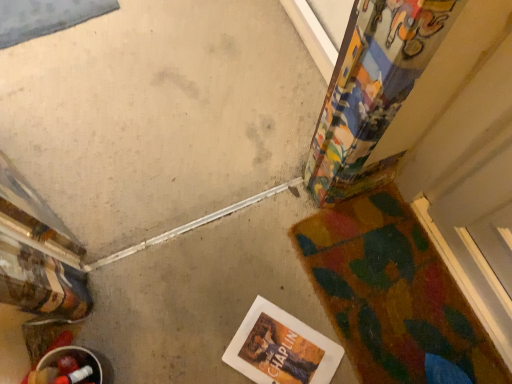
Where is `vacant point above hardcover book at lower center (from a real-world perspective)`? vacant point above hardcover book at lower center (from a real-world perspective) is located at coordinates (276, 347).